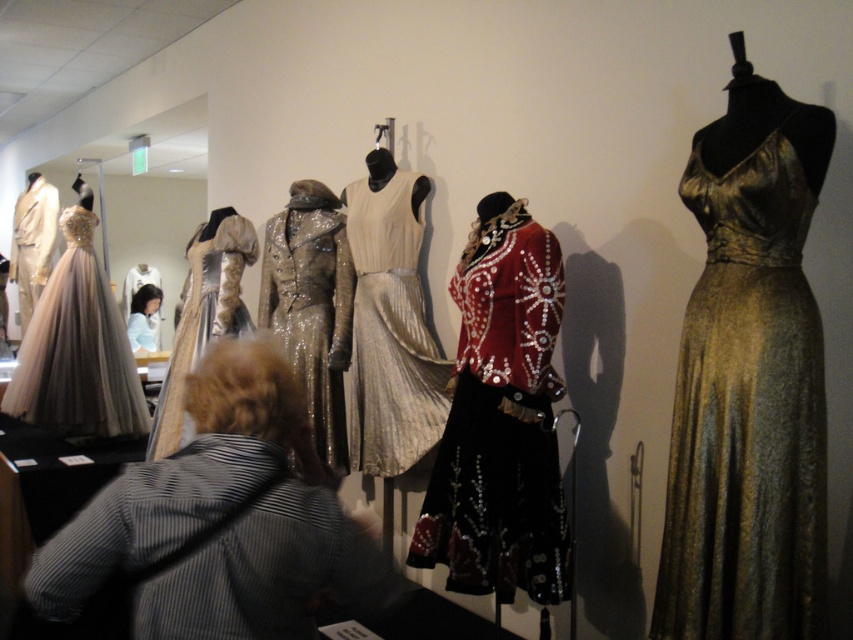
Question: Which of the following is the farthest from the observer?

Choices:
 (A) (379, 467)
 (B) (84, 596)
 (C) (126, 332)
 (D) (329, 204)

Answer: (C)

Question: Is shiny red velvet jacket at center closer to the viewer compared to matte gold gown at left?

Choices:
 (A) no
 (B) yes

Answer: (B)

Question: Can you confirm if striped fabric shirt at lower left is positioned above matte gold gown at left?

Choices:
 (A) no
 (B) yes

Answer: (A)

Question: Can you confirm if gold satin dress at right is thinner than shiny red velvet jacket at center?

Choices:
 (A) yes
 (B) no

Answer: (A)

Question: Which object is the closest to the shiny metallic coat at center?

Choices:
 (A) shiny red velvet jacket at center
 (B) silvery metallic gown at center
 (C) striped fabric shirt at lower left

Answer: (B)

Question: Which of the following is the closest to the observer?

Choices:
 (A) (809, 584)
 (B) (364, 428)
 (C) (138, 557)

Answer: (C)